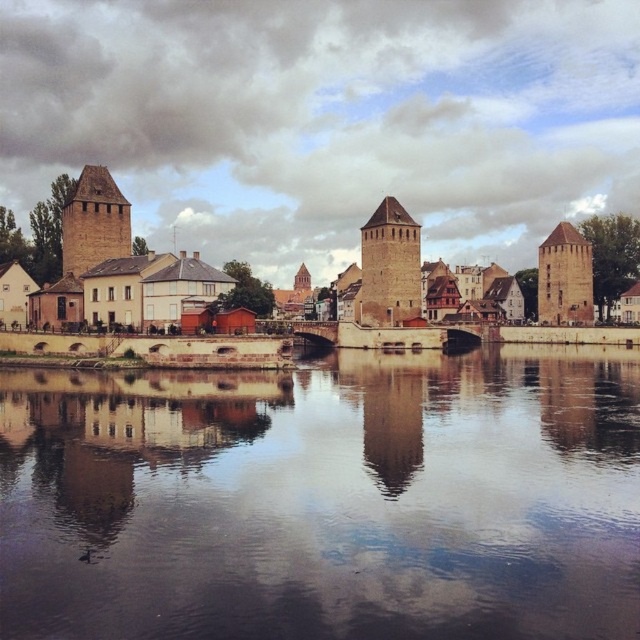
Question: Which point is farther to the camera?

Choices:
 (A) brown stone tower at left
 (B) brown stone buildings at left

Answer: (A)

Question: Does smooth reflective water at center have a greater width compared to brown stone tower at left?

Choices:
 (A) yes
 (B) no

Answer: (A)

Question: Is brown stone buildings at left to the right of brown stone tower at left from the viewer's perspective?

Choices:
 (A) yes
 (B) no

Answer: (A)

Question: Which point is closer to the camera?

Choices:
 (A) (408, 308)
 (B) (577, 301)
 (C) (157, 268)

Answer: (C)

Question: From the image, what is the correct spatial relationship of smooth reflective water at center in relation to brown stone buildings at left?

Choices:
 (A) above
 (B) below

Answer: (B)

Question: Which of these objects is positioned farthest from the brown stone tower at left?

Choices:
 (A) brown stone tower at right
 (B) brown stone tower at center
 (C) brown stone buildings at left
 (D) smooth reflective water at center

Answer: (A)